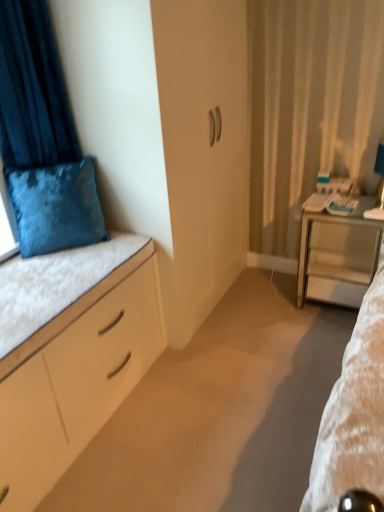
Question: From a real-world perspective, is matte white table lamp at right positioned under white matte cushion at left based on gravity?

Choices:
 (A) yes
 (B) no

Answer: (B)

Question: Does matte white table lamp at right come behind white matte cushion at left?

Choices:
 (A) yes
 (B) no

Answer: (A)

Question: Is matte white table lamp at right bigger than white matte cushion at left?

Choices:
 (A) no
 (B) yes

Answer: (A)

Question: From a real-world perspective, is matte white table lamp at right positioned over white matte cushion at left based on gravity?

Choices:
 (A) no
 (B) yes

Answer: (B)

Question: Can you confirm if matte white table lamp at right is smaller than white matte cushion at left?

Choices:
 (A) yes
 (B) no

Answer: (A)

Question: Is the depth of matte white table lamp at right less than that of white matte cushion at left?

Choices:
 (A) yes
 (B) no

Answer: (B)

Question: Is velvet blue cushion at upper left wider than velvet blue pillow at upper left?

Choices:
 (A) yes
 (B) no

Answer: (B)

Question: Considering the relative sizes of velvet blue cushion at upper left and velvet blue pillow at upper left in the image provided, is velvet blue cushion at upper left shorter than velvet blue pillow at upper left?

Choices:
 (A) no
 (B) yes

Answer: (A)

Question: Does velvet blue cushion at upper left turn towards velvet blue pillow at upper left?

Choices:
 (A) no
 (B) yes

Answer: (B)

Question: From the image's perspective, does velvet blue cushion at upper left appear higher than velvet blue pillow at upper left?

Choices:
 (A) no
 (B) yes

Answer: (B)

Question: Does velvet blue cushion at upper left have a lesser width compared to velvet blue pillow at upper left?

Choices:
 (A) yes
 (B) no

Answer: (A)

Question: Does velvet blue cushion at upper left have a larger size compared to velvet blue pillow at upper left?

Choices:
 (A) no
 (B) yes

Answer: (B)

Question: Considering the relative positions of metallic silver desk at right and velvet blue cushion at upper left in the image provided, is metallic silver desk at right in front of velvet blue cushion at upper left?

Choices:
 (A) no
 (B) yes

Answer: (A)